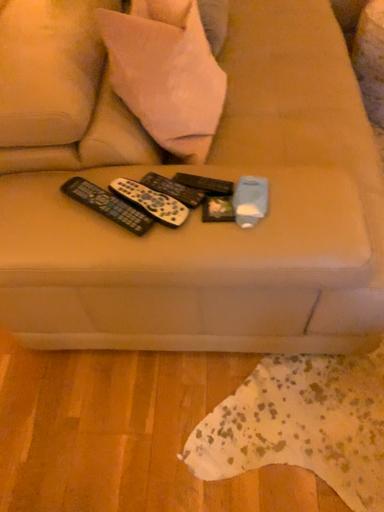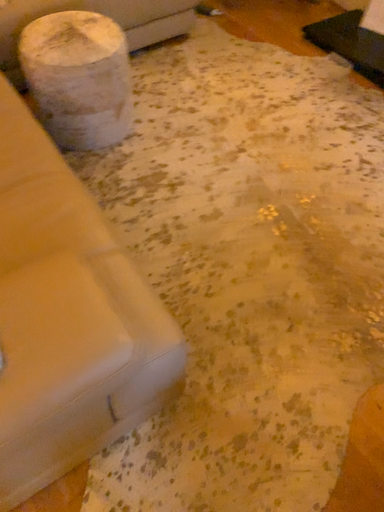
Question: How did the camera likely rotate when shooting the video?

Choices:
 (A) rotated downward
 (B) rotated upward

Answer: (B)